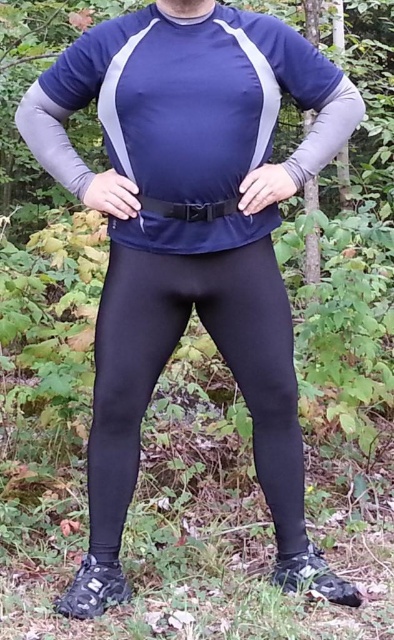
Question: Is black matte leggings at center below black matte belt at center?

Choices:
 (A) yes
 (B) no

Answer: (A)

Question: Which object appears farthest from the camera in this image?

Choices:
 (A) black matte leggings at center
 (B) black matte belt at center

Answer: (A)

Question: Which point is closer to the camera?

Choices:
 (A) (102, 492)
 (B) (230, 209)

Answer: (B)

Question: Is black matte leggings at center positioned at the back of black matte belt at center?

Choices:
 (A) no
 (B) yes

Answer: (B)

Question: Can you confirm if black matte leggings at center is thinner than black matte belt at center?

Choices:
 (A) yes
 (B) no

Answer: (B)

Question: Which point is closer to the camera?

Choices:
 (A) black matte leggings at center
 (B) black matte belt at center

Answer: (B)